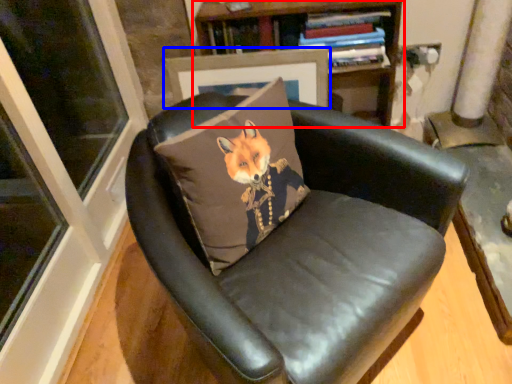
Question: Which object is closer to the camera taking this photo, bookcase (highlighted by a red box) or picture frame (highlighted by a blue box)?

Choices:
 (A) bookcase
 (B) picture frame

Answer: (A)